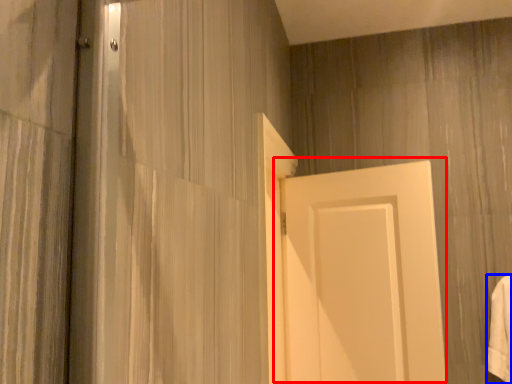
Question: Which point is further to the camera, door (highlighted by a red box) or bath towel (highlighted by a blue box)?

Choices:
 (A) door
 (B) bath towel

Answer: (B)